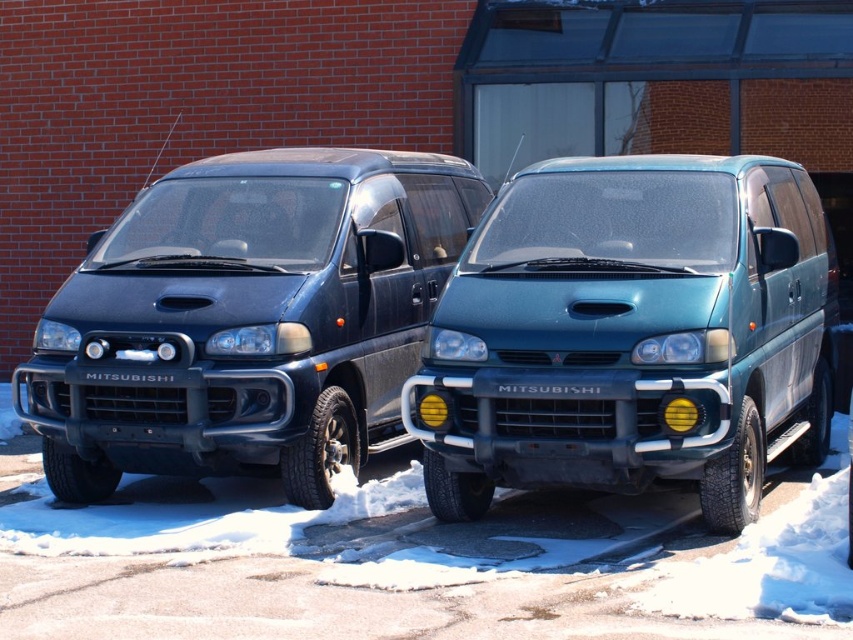
Question: Which of the following is the farthest from the observer?

Choices:
 (A) matte black van at left
 (B) teal matte van at center

Answer: (A)

Question: Is teal matte van at center bigger than matte black van at left?

Choices:
 (A) yes
 (B) no

Answer: (B)

Question: Can you confirm if teal matte van at center is positioned to the left of matte black van at left?

Choices:
 (A) no
 (B) yes

Answer: (A)

Question: Can you confirm if teal matte van at center is bigger than matte black van at left?

Choices:
 (A) yes
 (B) no

Answer: (B)